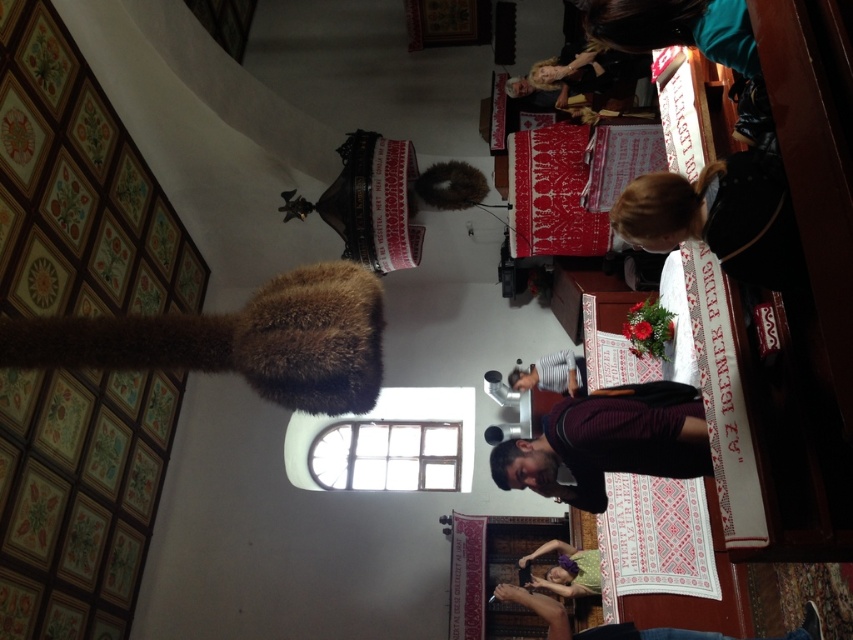
In the scene shown: Can you confirm if maroon sweater at center is positioned below striped cotton shirt at center?

Indeed, maroon sweater at center is positioned under striped cotton shirt at center.

Who is shorter, maroon sweater at center or striped cotton shirt at center?

Standing shorter between the two is striped cotton shirt at center.

Is point (538, 484) in front of point (538, 378)?

Yes, it is.

Where is `maroon sweater at center`? This screenshot has width=853, height=640. maroon sweater at center is located at coordinates (608, 442).

Who is shorter, maroon sweater at center or brown furry hat at center?

Standing shorter between the two is brown furry hat at center.

Can you confirm if maroon sweater at center is positioned to the left of brown furry hat at center?

Incorrect, maroon sweater at center is not on the left side of brown furry hat at center.

Between point (651, 444) and point (473, 182), which one is positioned in front?

Point (651, 444) is in front.

This screenshot has height=640, width=853. I want to click on maroon sweater at center, so click(x=608, y=442).

Is point (525, 632) more distant than point (582, 376)?

No, it is in front of (582, 376).

Is wooden at center shorter than striped cotton shirt at center?

In fact, wooden at center may be taller than striped cotton shirt at center.

Which is behind, point (550, 561) or point (553, 384)?

The point (553, 384) is more distant.

Identify the location of wooden at center. (518, 545).